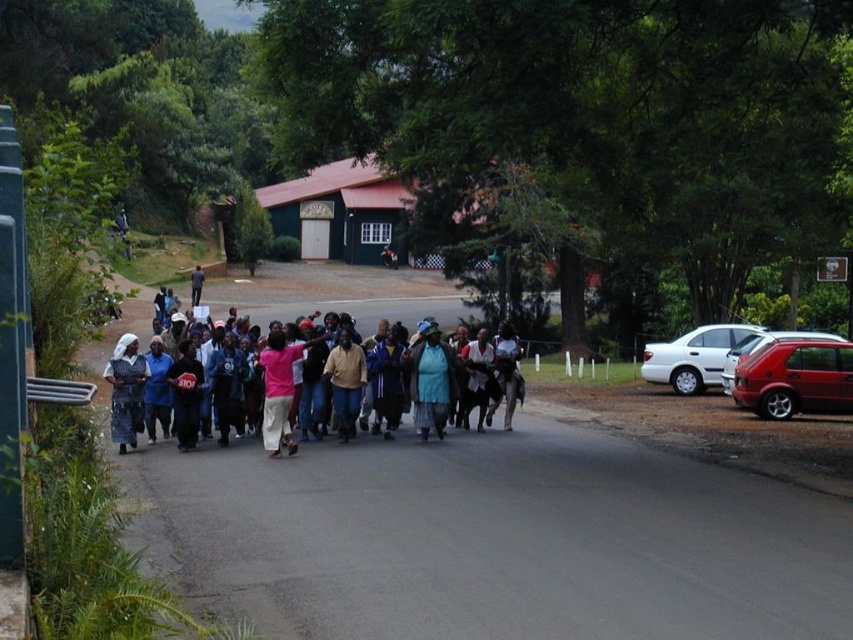
Question: Which point is farther to the camera?

Choices:
 (A) metallic red hatchback at right
 (B) matte black dress at center
 (C) pink fabric at center

Answer: (C)

Question: Does white matte sedan at right have a lesser width compared to matte black dress at center?

Choices:
 (A) yes
 (B) no

Answer: (B)

Question: Among these objects, which one is farthest from the camera?

Choices:
 (A) pink fabric at center
 (B) metallic red hatchback at right
 (C) matte black dress at center

Answer: (A)

Question: Does matte black dress at center appear under pink fabric at center?

Choices:
 (A) yes
 (B) no

Answer: (A)

Question: Is white matte sedan at right behind pink fabric at center?

Choices:
 (A) yes
 (B) no

Answer: (A)

Question: Which point appears closest to the camera in this image?

Choices:
 (A) (125, 412)
 (B) (300, 310)

Answer: (A)